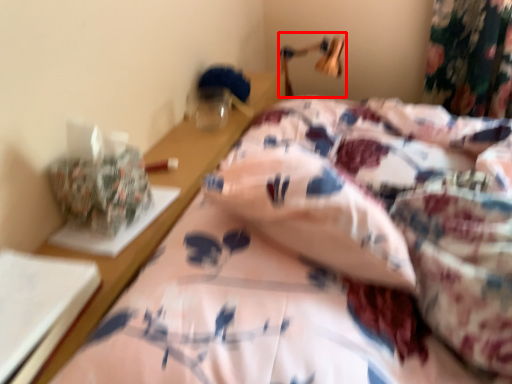
Question: From the image's perspective, what is the correct spatial relationship of table lamp (annotated by the red box) in relation to bed?

Choices:
 (A) below
 (B) above

Answer: (B)